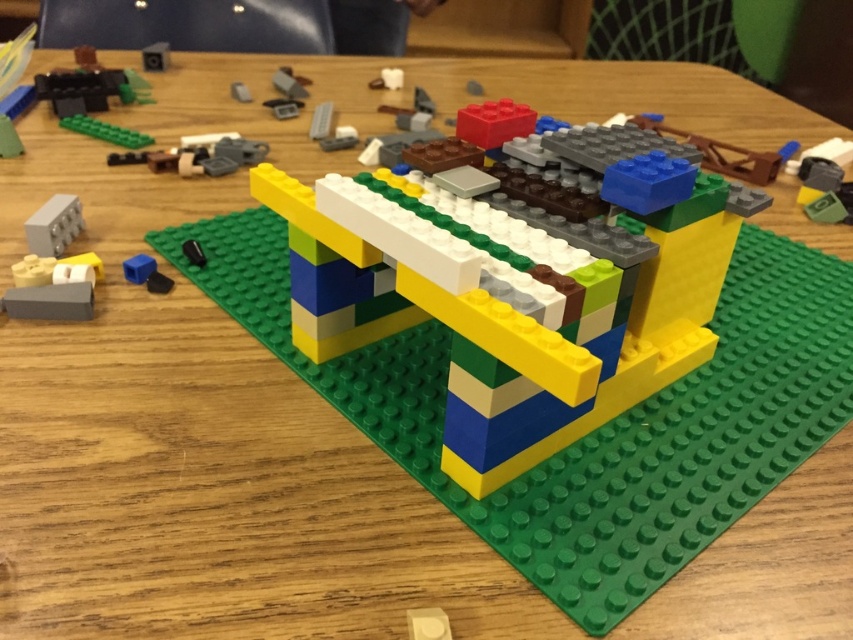
Question: Does matte plastic bridge at center appear on the right side of gray matte brick at upper left?

Choices:
 (A) yes
 (B) no

Answer: (A)

Question: Which point is farther from the camera taking this photo?

Choices:
 (A) (593, 216)
 (B) (36, 244)

Answer: (B)

Question: Does matte plastic bridge at center have a lesser width compared to gray matte brick at upper left?

Choices:
 (A) no
 (B) yes

Answer: (A)

Question: Can you confirm if matte plastic bridge at center is smaller than gray matte brick at upper left?

Choices:
 (A) yes
 (B) no

Answer: (B)

Question: Which point is closer to the camera?

Choices:
 (A) (517, 435)
 (B) (39, 237)

Answer: (A)

Question: Which point is farther to the camera?

Choices:
 (A) matte plastic bridge at center
 (B) gray matte brick at upper left

Answer: (B)